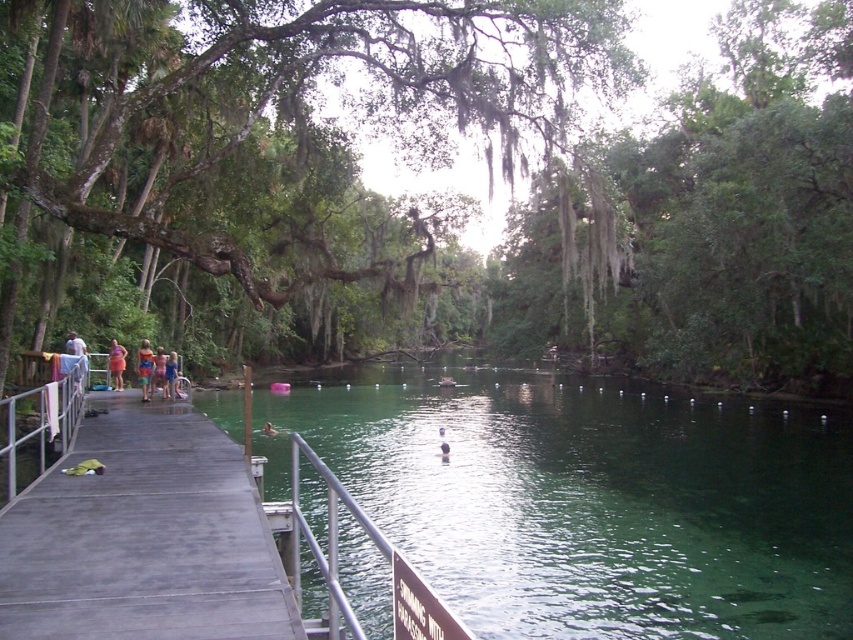
Consider the image. Does orange fabric dress at left have a greater height compared to orange fabric dress at center?

Yes, orange fabric dress at left is taller than orange fabric dress at center.

Which is below, orange fabric dress at left or orange fabric dress at center?

orange fabric dress at center is lower down.

Measure the distance between orange fabric dress at left and camera.

orange fabric dress at left and camera are 19.46 meters apart from each other.

Identify the location of orange fabric dress at left. This screenshot has height=640, width=853. (115, 364).

Does green translucent water at center appear under gray wooden dock at left?

Indeed, green translucent water at center is positioned under gray wooden dock at left.

Where is `green translucent water at center`? The width and height of the screenshot is (853, 640). green translucent water at center is located at coordinates (589, 499).

Describe the element at coordinates (589, 499) in the screenshot. The width and height of the screenshot is (853, 640). I see `green translucent water at center` at that location.

Identify the location of green translucent water at center. (589, 499).

From the picture: Between green mossy tree at upper center and white cotton shirt at left, which one is positioned higher?

Positioned higher is green mossy tree at upper center.

Between green mossy tree at upper center and white cotton shirt at left, which one has less height?

With less height is white cotton shirt at left.

Who is more distant from viewer, (x=349, y=243) or (x=86, y=378)?

The point (x=86, y=378) is more distant.

At what (x,y) coordinates should I click in order to perform the action: click on green mossy tree at upper center. Please return your answer as a coordinate pair (x, y). This screenshot has width=853, height=640. Looking at the image, I should click on (283, 156).